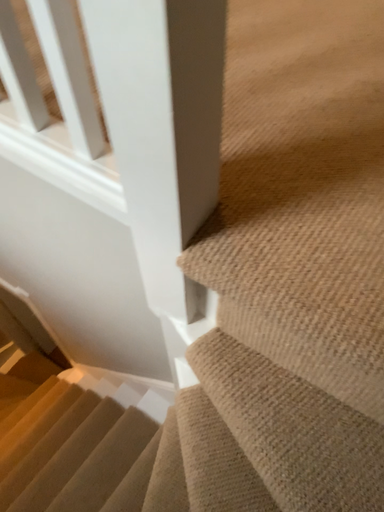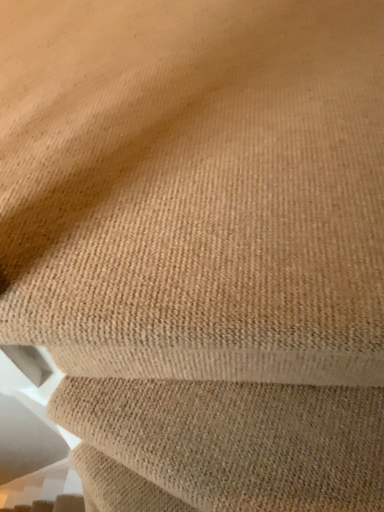
Question: How did the camera likely rotate when shooting the video?

Choices:
 (A) rotated left
 (B) rotated right

Answer: (B)